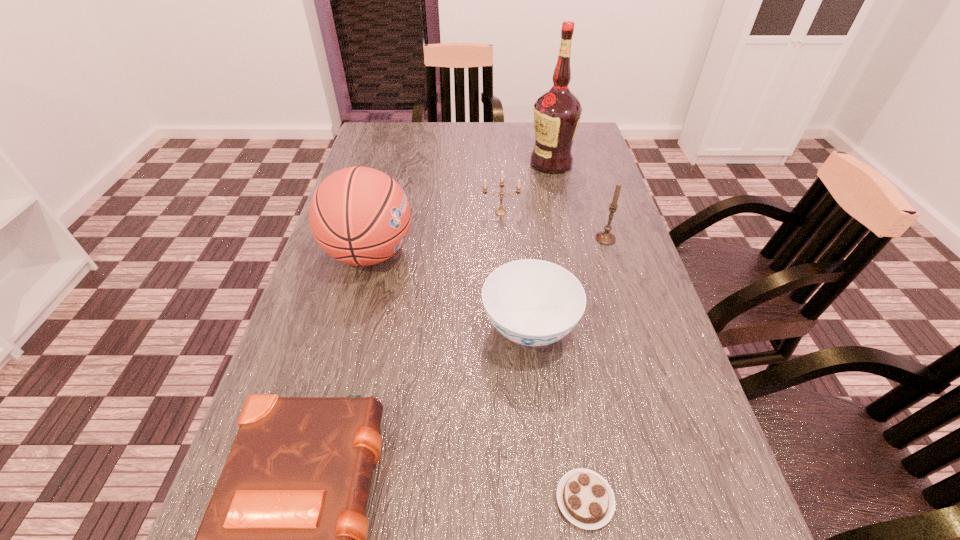
Where is `the tallest object`? The width and height of the screenshot is (960, 540). the tallest object is located at coordinates (557, 112).

The image size is (960, 540). Identify the location of the farthest object. (557, 112).

Identify the location of the second tallest object. (360, 216).

This screenshot has height=540, width=960. I want to click on the rightmost object, so click(x=605, y=237).

The height and width of the screenshot is (540, 960). In order to click on the right candle in this screenshot , I will do `click(605, 237)`.

Find the location of a particular element. The height and width of the screenshot is (540, 960). the second farthest object is located at coordinates 500,212.

You are a GUI agent. You are given a task and a screenshot of the screen. Output one action in this format:
    pyautogui.click(x=<x>, y=<y>)
    Task: Click on the fourth tallest object
    
    Given the screenshot: What is the action you would take?
    pos(500,212)

Locate an element on the screen. This screenshot has width=960, height=540. the fifth farthest object is located at coordinates (531, 302).

You are a GUI agent. You are given a task and a screenshot of the screen. Output one action in this format:
    pyautogui.click(x=<x>, y=<y>)
    Task: Click on the third shortest object
    
    Given the screenshot: What is the action you would take?
    pyautogui.click(x=531, y=302)

Identify the location of chocolate cake. coord(585,498).